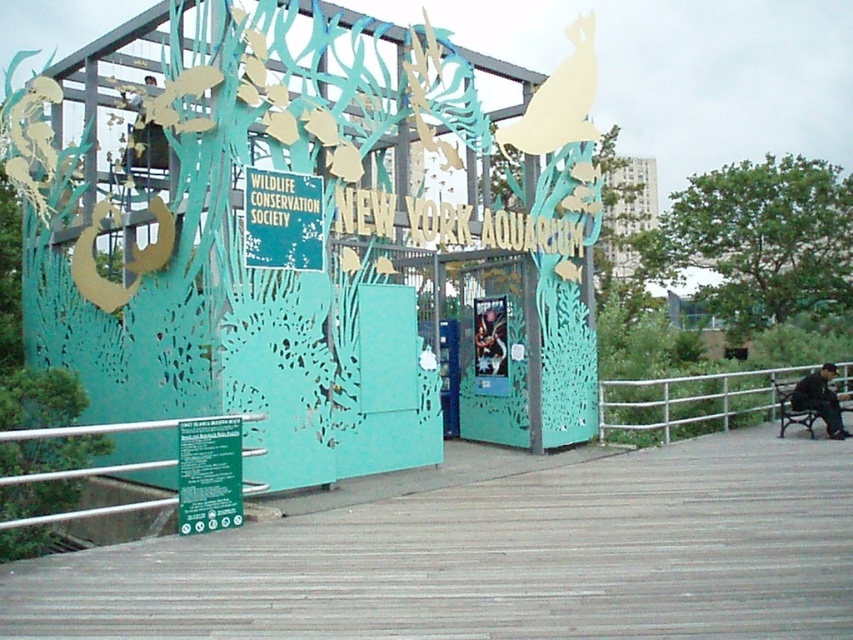
Question: Is wooden planks at lower center below white metal railing at lower right?

Choices:
 (A) yes
 (B) no

Answer: (A)

Question: Which point appears farthest from the camera in this image?

Choices:
 (A) (668, 436)
 (B) (605, 618)

Answer: (A)

Question: Is wooden planks at lower center above white metal railing at lower right?

Choices:
 (A) no
 (B) yes

Answer: (A)

Question: Does wooden planks at lower center lie in front of white metal railing at lower right?

Choices:
 (A) no
 (B) yes

Answer: (B)

Question: Which point is farther to the camera?

Choices:
 (A) (631, 628)
 (B) (608, 401)

Answer: (B)